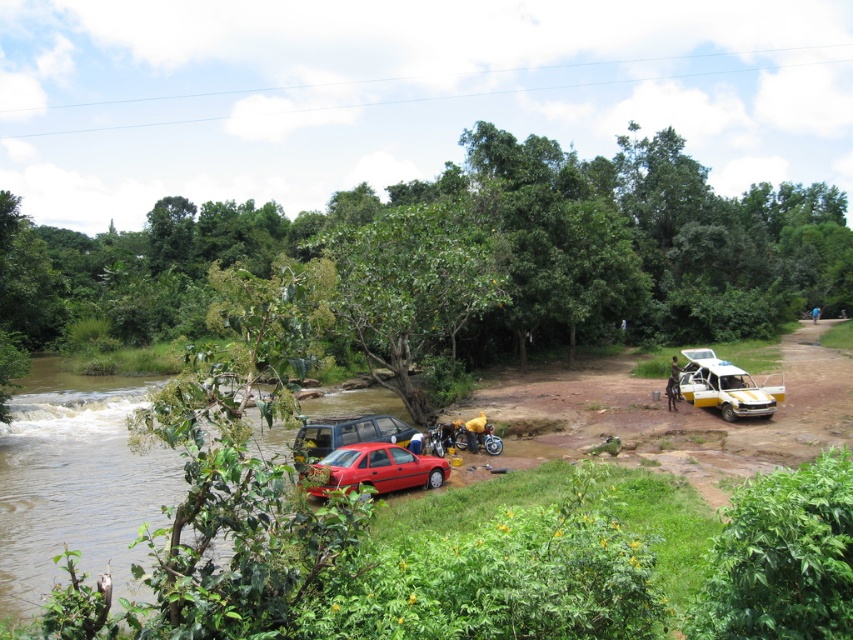
You are standing at the point labeled point (363, 468) and want to walk to the point labeled point (721, 385). Which direction should you move relative to your current position?

You should move backward because point (363, 468) is in front of point (721, 385).

You are a photographer trying to capture a clear shot of the shiny red car at lower center and the yellow matte car at right. Since you want to focus on the height difference between them, which car should you position closer to the camera to emphasize their height difference?

To emphasize the height difference between the shiny red car at lower center and the yellow matte car at right, you should position the shiny red car at lower center closer to the camera since it is much taller than the yellow matte car at right.

You are standing at the center of the image and want to reach the yellow matte car at right. Which direction should you move to get there?

The yellow matte car at right is located at point 0.606 on the x axis and 0.851 on the y axis, so you should move towards the right and slightly downward direction to reach it.